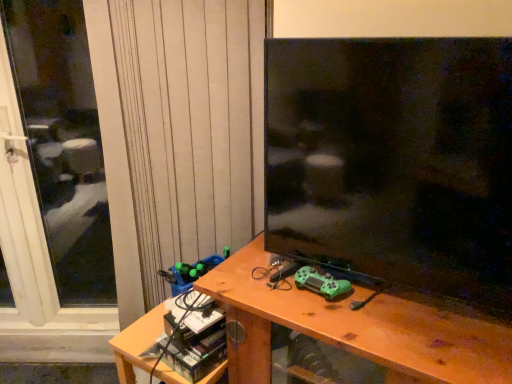
Where is `free space that is in between matte black tv at center and green matte game controller at center, which is the first toy from right to left`? free space that is in between matte black tv at center and green matte game controller at center, which is the first toy from right to left is located at coordinates pyautogui.click(x=388, y=307).